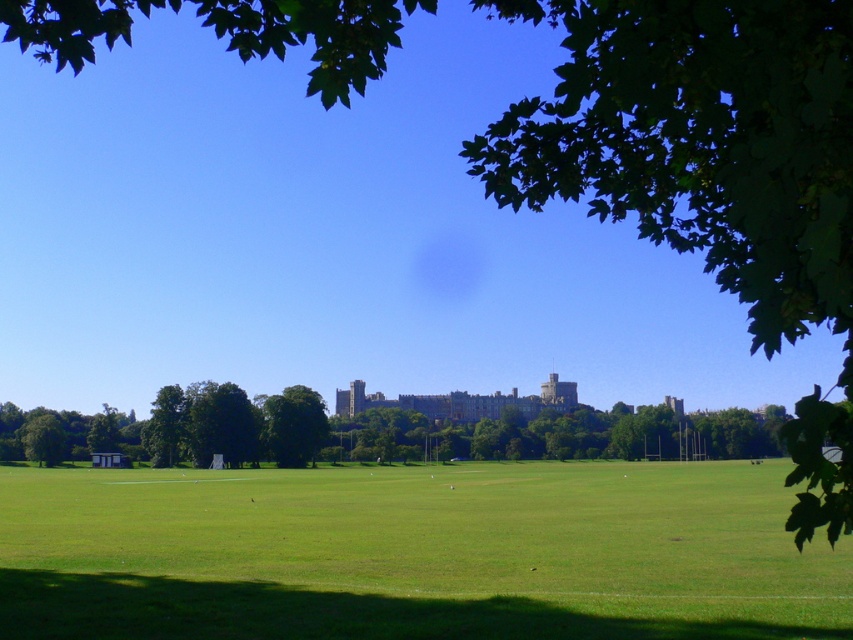
Question: Which of the following is the closest to the observer?

Choices:
 (A) (699, 588)
 (B) (281, 445)

Answer: (A)

Question: From the image, what is the correct spatial relationship of green grass field at center in relation to green leafy tree at center?

Choices:
 (A) right
 (B) left

Answer: (A)

Question: Can you confirm if green grass field at center is wider than green leafy tree at center?

Choices:
 (A) yes
 (B) no

Answer: (A)

Question: Is green grass field at center below green leafy tree at center?

Choices:
 (A) yes
 (B) no

Answer: (B)